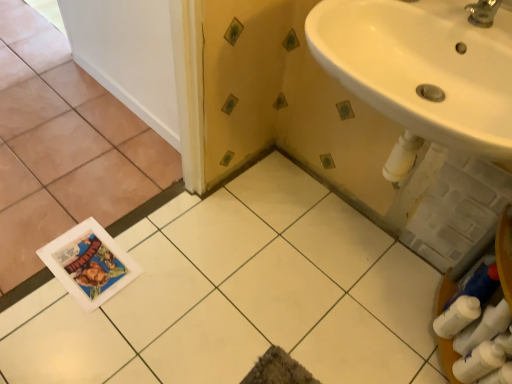
Where is `free space in front of white matte toilet paper at lower right`? free space in front of white matte toilet paper at lower right is located at coordinates (429, 364).